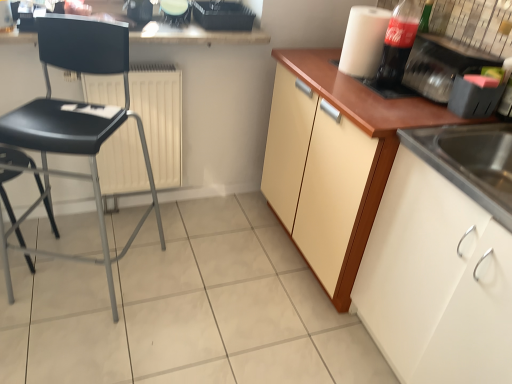
Question: Is white matte cabinet at lower right, arranged as the 2th cabinetry when viewed from the back, in front of or behind white matte paper towel at upper right in the image?

Choices:
 (A) front
 (B) behind

Answer: (A)

Question: Choose the correct answer: Is white matte cabinet at lower right, arranged as the 2th cabinetry when viewed from the back, inside white matte paper towel at upper right or outside it?

Choices:
 (A) outside
 (B) inside

Answer: (A)

Question: Estimate the real-world distances between objects in this image. Which object is farther from the black plastic tray at upper center, which is counted as the 2th appliance, starting from the left?

Choices:
 (A) black plastic chair at left, the first chair viewed from the left
 (B) translucent plastic bottle at upper right
 (C) white glossy blender at upper center, placed as the 1th appliance when sorted from left to right
 (D) smooth white countertop at upper center
 (E) white matte cabinet at lower right, which appears as the first cabinetry when viewed from the front

Answer: (E)

Question: Which of these objects is positioned closest to the white matte radiator at center?

Choices:
 (A) black plastic tray at upper center, which is counted as the 2th appliance, starting from the left
 (B) matte wood cabinet at right, the 1th cabinetry from the back
 (C) white matte cabinet at lower right, which appears as the first cabinetry when viewed from the front
 (D) stainless steel sink at lower right
 (E) black plastic chair at left, acting as the 2th chair starting from the left

Answer: (E)